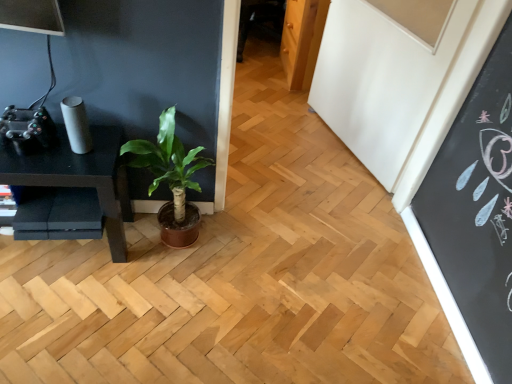
Find the location of `free point to the right of black matte table at left`. free point to the right of black matte table at left is located at coordinates (150, 293).